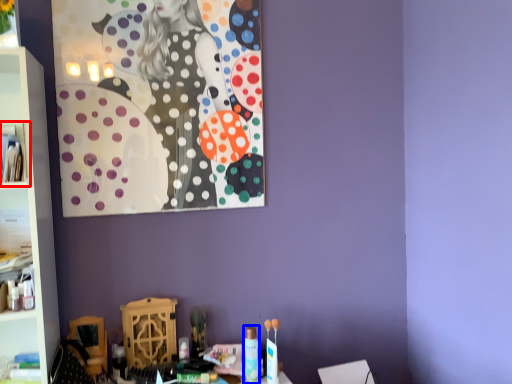
Question: Among these objects, which one is nearest to the camera, cabinet (highlighted by a red box) or toiletry (highlighted by a blue box)?

Choices:
 (A) cabinet
 (B) toiletry

Answer: (A)